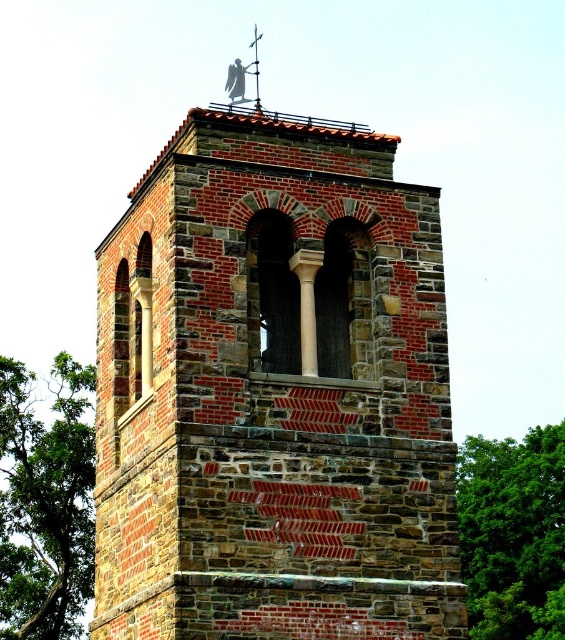
Looking at this image, does green leafy tree at lower left appear on the right side of green leafy tree at right?

Incorrect, green leafy tree at lower left is not on the right side of green leafy tree at right.

Which is behind, point (92, 536) or point (514, 605)?

Positioned behind is point (514, 605).

You are a GUI agent. You are given a task and a screenshot of the screen. Output one action in this format:
    pyautogui.click(x=<x>, y=<y>)
    Task: Click on the green leafy tree at lower left
    The image size is (565, 640).
    Given the screenshot: What is the action you would take?
    pyautogui.click(x=45, y=502)

Can you confirm if brick tower at center is positioned to the right of green leafy tree at lower left?

Correct, you'll find brick tower at center to the right of green leafy tree at lower left.

Can you confirm if brick tower at center is shorter than green leafy tree at lower left?

Incorrect, brick tower at center's height does not fall short of green leafy tree at lower left's.

Who is more distant from viewer, (406, 461) or (73, 378)?

Positioned behind is point (73, 378).

Find the location of `brick tower at center`. brick tower at center is located at coordinates (275, 392).

Is brick tower at center above green leafy tree at right?

Indeed, brick tower at center is positioned over green leafy tree at right.

Does brick tower at center appear on the right side of green leafy tree at right?

Incorrect, brick tower at center is not on the right side of green leafy tree at right.

At what (x,y) coordinates should I click in order to perform the action: click on brick tower at center. Please return your answer as a coordinate pair (x, y). Looking at the image, I should click on (275, 392).